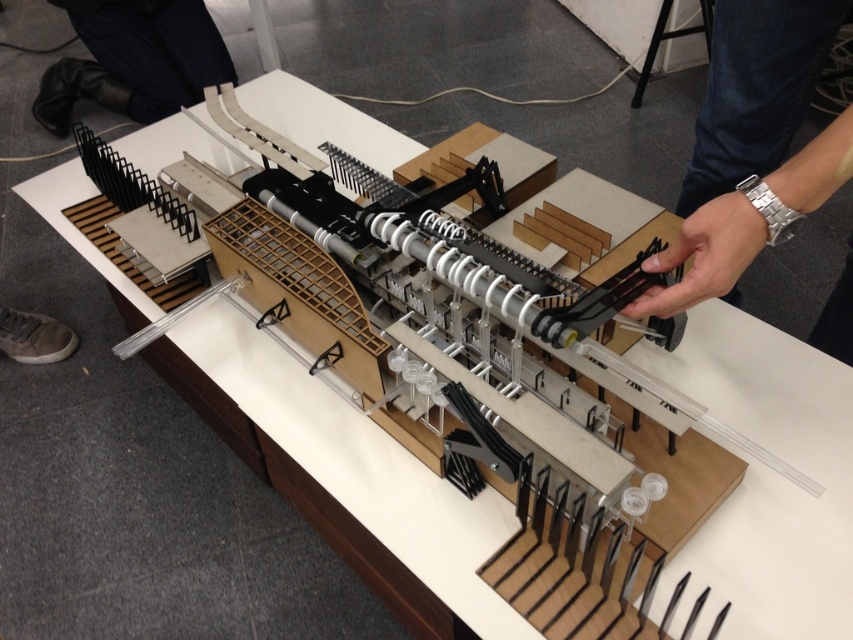
Question: Does silver metallic wristwatch at upper right appear over black leather pants at upper left?

Choices:
 (A) no
 (B) yes

Answer: (A)

Question: Can you confirm if silver metallic wristwatch at upper right is positioned below black leather pants at upper left?

Choices:
 (A) yes
 (B) no

Answer: (A)

Question: Can you confirm if silver metallic wristwatch at upper right is thinner than black leather pants at upper left?

Choices:
 (A) yes
 (B) no

Answer: (A)

Question: Among these objects, which one is nearest to the camera?

Choices:
 (A) silver metallic wristwatch at upper right
 (B) black leather pants at upper left

Answer: (A)